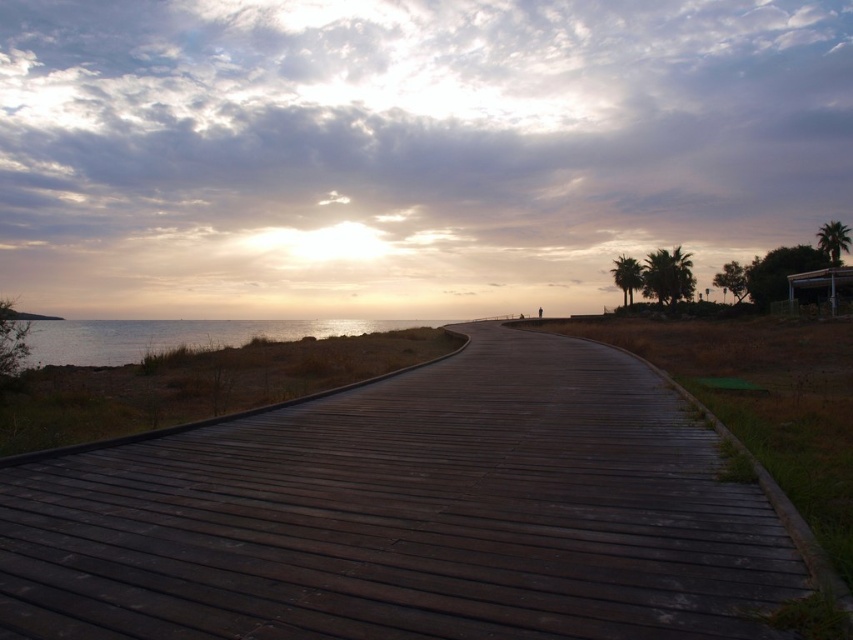
Question: Can you confirm if dark brown wooden path at center is positioned above shiny metallic water at left?

Choices:
 (A) no
 (B) yes

Answer: (A)

Question: Does dark brown wooden path at center have a greater width compared to shiny metallic water at left?

Choices:
 (A) no
 (B) yes

Answer: (A)

Question: Which of the following is the closest to the observer?

Choices:
 (A) (38, 355)
 (B) (309, 412)

Answer: (B)

Question: Which object appears closest to the camera in this image?

Choices:
 (A) dark brown wooden path at center
 (B) shiny metallic water at left

Answer: (A)

Question: Does dark brown wooden path at center lie in front of shiny metallic water at left?

Choices:
 (A) no
 (B) yes

Answer: (B)